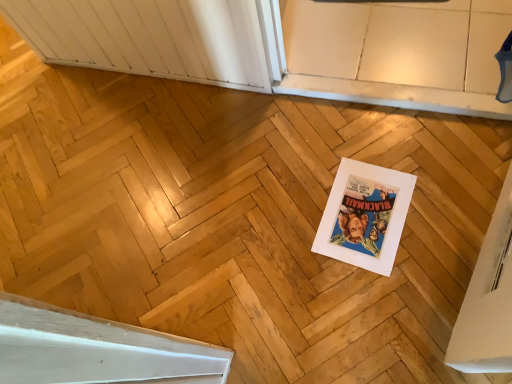
Find the location of a particular element. Image resolution: width=512 pixels, height=384 pixels. free region under white paper comic book at center (from a real-world perspective) is located at coordinates (366, 217).